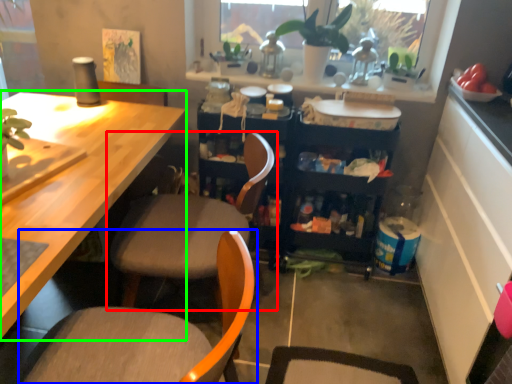
Question: Which object is the closest to the chair (highlighted by a red box)? Choose among these: chair (highlighted by a blue box) or desk (highlighted by a green box).

Choices:
 (A) chair
 (B) desk

Answer: (B)